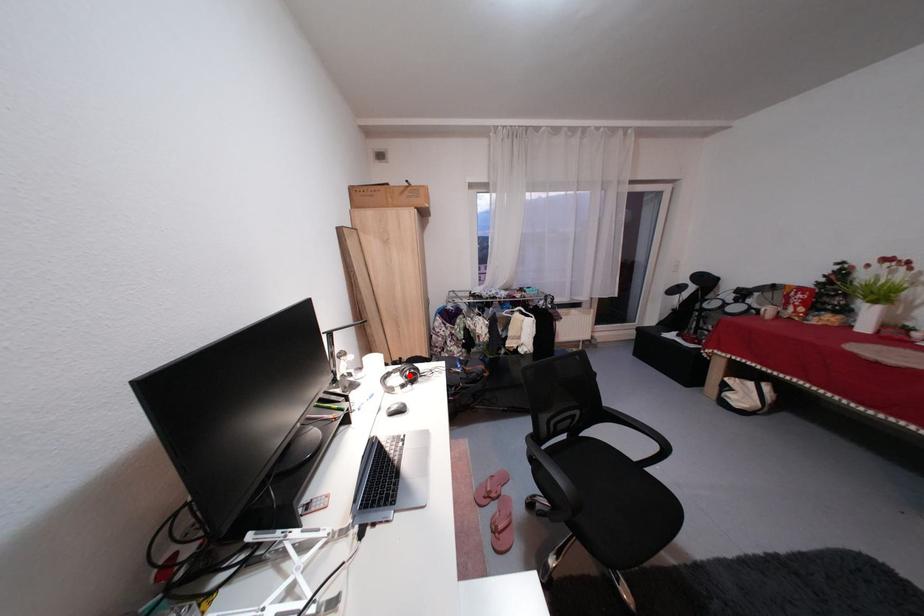
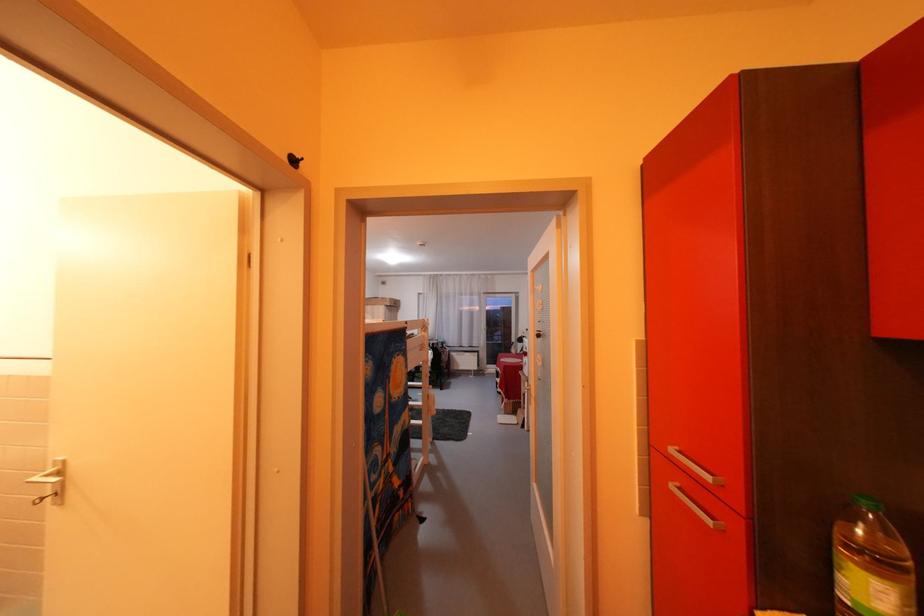
Question: I am providing you with two images of the same scene from different viewpoints. A red point is marked on the first image. Is the red point's position out of view in image 2?

Choices:
 (A) Yes
 (B) No

Answer: (A)